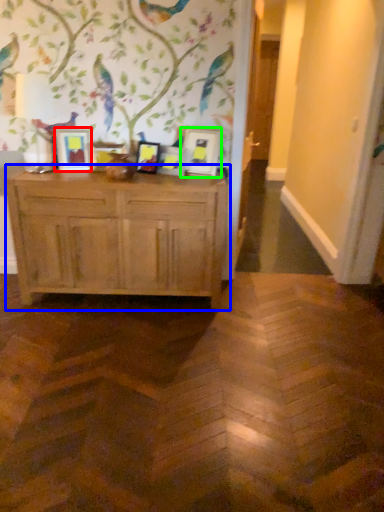
Question: Estimate the real-world distances between objects in this image. Which object is closer to picture frame (highlighted by a red box), chest of drawers (highlighted by a blue box) or picture frame (highlighted by a green box)?

Choices:
 (A) chest of drawers
 (B) picture frame

Answer: (A)